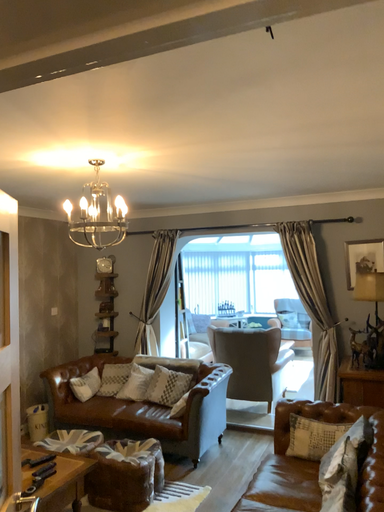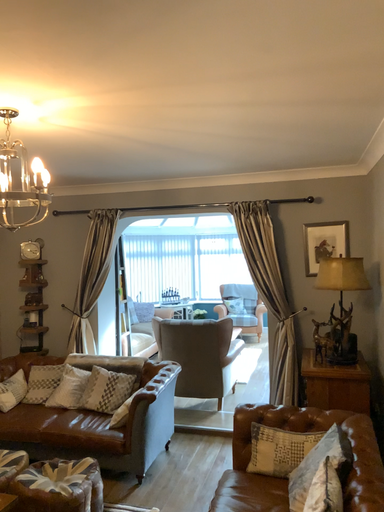
Question: Which way did the camera rotate in the video?

Choices:
 (A) rotated right
 (B) rotated left

Answer: (A)